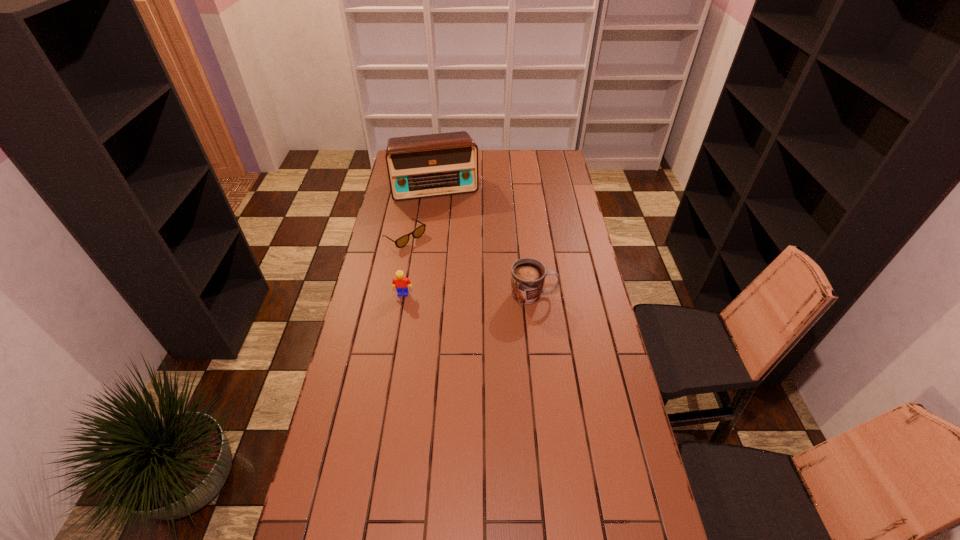
Where is `free region located 0.110m on the front-facing side of the third nearest object`? free region located 0.110m on the front-facing side of the third nearest object is located at coordinates (436, 259).

Locate an element on the screen. This screenshot has width=960, height=540. vacant region located on the front-facing side of the farthest object is located at coordinates (454, 255).

The width and height of the screenshot is (960, 540). Identify the location of free region located 0.060m on the front-facing side of the farthest object. (444, 209).

Find the location of a particular element. vacant space situated 0.270m on the front-facing side of the farthest object is located at coordinates (450, 237).

Locate an element on the screen. The height and width of the screenshot is (540, 960). object at the far edge is located at coordinates (431, 165).

I want to click on Lego situated at the left edge, so click(x=400, y=282).

Locate an element on the screen. sunglasses that is at the left edge is located at coordinates (419, 231).

The width and height of the screenshot is (960, 540). What are the coordinates of `radio receiver present at the left edge` in the screenshot? It's located at (431, 165).

The width and height of the screenshot is (960, 540). I want to click on object present at the right edge, so coord(528,275).

The image size is (960, 540). In order to click on object that is positioned at the far left corner in this screenshot , I will do `click(431, 165)`.